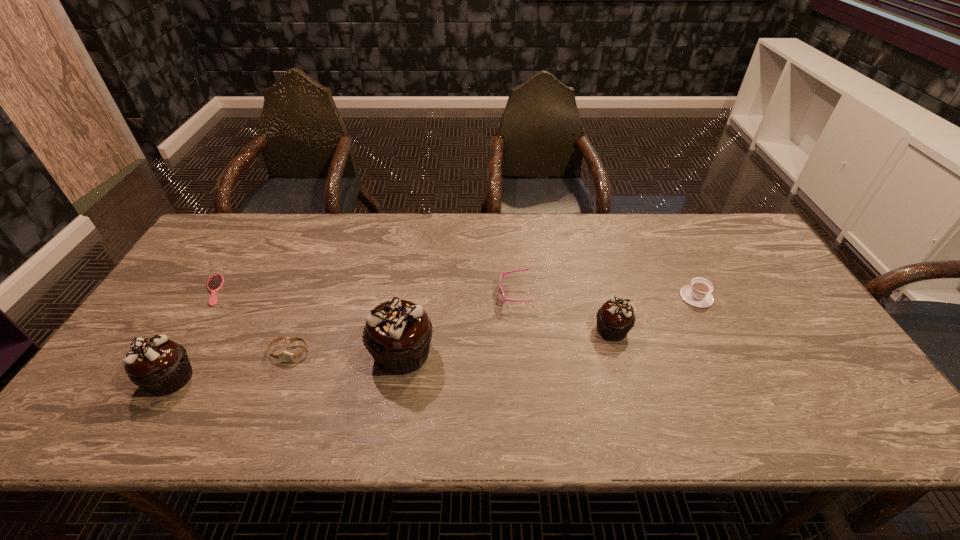
This screenshot has width=960, height=540. I want to click on the fifth object from right to left, so click(284, 356).

The height and width of the screenshot is (540, 960). Find the location of `free region located 0.270m on the back of the sixth shortest object`. free region located 0.270m on the back of the sixth shortest object is located at coordinates (228, 283).

The width and height of the screenshot is (960, 540). Identify the location of vacant region located 0.270m on the left of the second cupcake from right to left. (261, 353).

The width and height of the screenshot is (960, 540). I want to click on vacant area located 0.260m on the left of the third tallest object, so click(495, 330).

Find the location of `vacant area situated 0.060m on the left of the hairbrush`. vacant area situated 0.060m on the left of the hairbrush is located at coordinates (182, 290).

This screenshot has height=540, width=960. I want to click on vacant area situated 0.080m on the handle side of the teacup, so click(682, 267).

Find the location of a particular element. vacant space situated 0.230m on the handle side of the teacup is located at coordinates (666, 237).

Locate an element on the screen. The width and height of the screenshot is (960, 540). free location located on the handle side of the teacup is located at coordinates (660, 225).

Where is `free space located on the front-facing side of the sunglasses`? The height and width of the screenshot is (540, 960). free space located on the front-facing side of the sunglasses is located at coordinates (387, 295).

This screenshot has height=540, width=960. I want to click on vacant area situated 0.360m on the front-facing side of the sunglasses, so click(x=372, y=295).